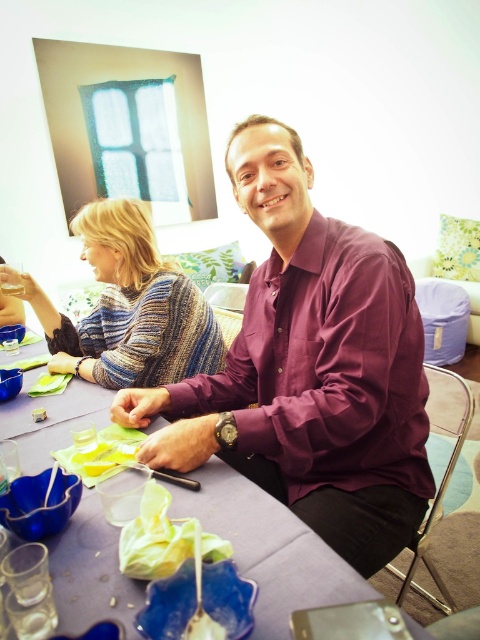
Image resolution: width=480 pixels, height=640 pixels. Describe the element at coordinates (268, 548) in the screenshot. I see `purple fabric table at center` at that location.

Is purple fabric table at center in front of translucent yellow paper at table center?

Yes, purple fabric table at center is closer to the viewer.

Measure the distance between purple fabric table at center and camera.

A distance of 55.42 centimeters exists between purple fabric table at center and camera.

Locate an element on the screen. The height and width of the screenshot is (640, 480). purple fabric table at center is located at coordinates (268, 548).

Does purple fabric table at center lie behind knitted sweater at upper left?

No, purple fabric table at center is in front of knitted sweater at upper left.

Locate an element on the screen. The height and width of the screenshot is (640, 480). purple fabric table at center is located at coordinates (268, 548).

Is point (41, 445) more distant than point (85, 355)?

That is False.

You are a GUI agent. You are given a task and a screenshot of the screen. Output one action in this format:
    pyautogui.click(x=<x>, y=<y>)
    Task: Click on the purple fabric table at center
    The height and width of the screenshot is (640, 480).
    Given the screenshot: What is the action you would take?
    click(x=268, y=548)

Between purple matte shirt at center and translucent yellow paper at table center, which one has less height?

Standing shorter between the two is translucent yellow paper at table center.

Does purple matte shirt at center have a lesser height compared to translucent yellow paper at table center?

In fact, purple matte shirt at center may be taller than translucent yellow paper at table center.

Where is `purple matte shirt at center`? This screenshot has height=640, width=480. purple matte shirt at center is located at coordinates (310, 369).